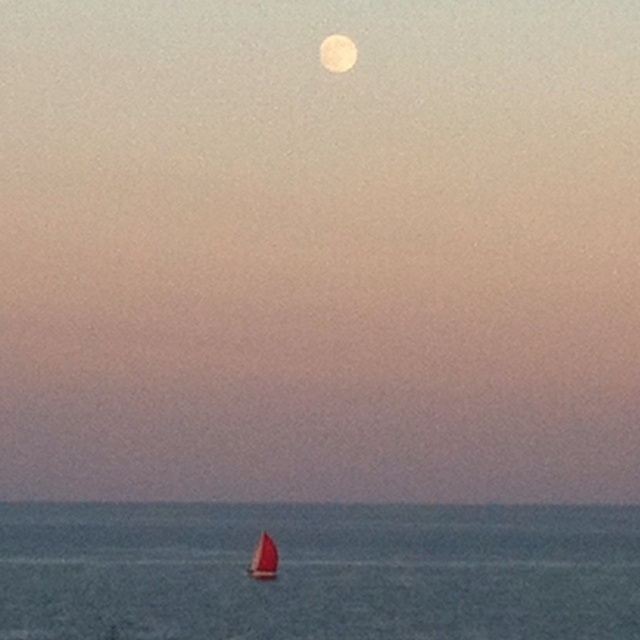
In the scene shown: You are an astronomer observing the sky from the deck of the red sailboat at lower center. Which direction should you look to see the smooth white moon at upper center?

The smooth white moon at upper center is to the right of the red sailboat at lower center, so you should look to your right to see it.

You are standing on the deck of a ship and see two points in the distance. The first point is at coordinates point (256, 525) and the second is at point (276, 548). Which point is closer to you?

Point (256, 525) is closer to you because it is further to the viewer than point (276, 548).

From the picture: You are an astronomer observing the night sky and see the blue water at center and the smooth white moon at upper center. Based on their positions, can you determine if the moon is in the eastern or western part of the sky?

The blue water at center is positioned on the left side of the smooth white moon at upper center. Since the moon appears in the eastern sky during sunrise and the western sky during sunset, and the water is to the left of the moon, it suggests the moon is in the western part of the sky.